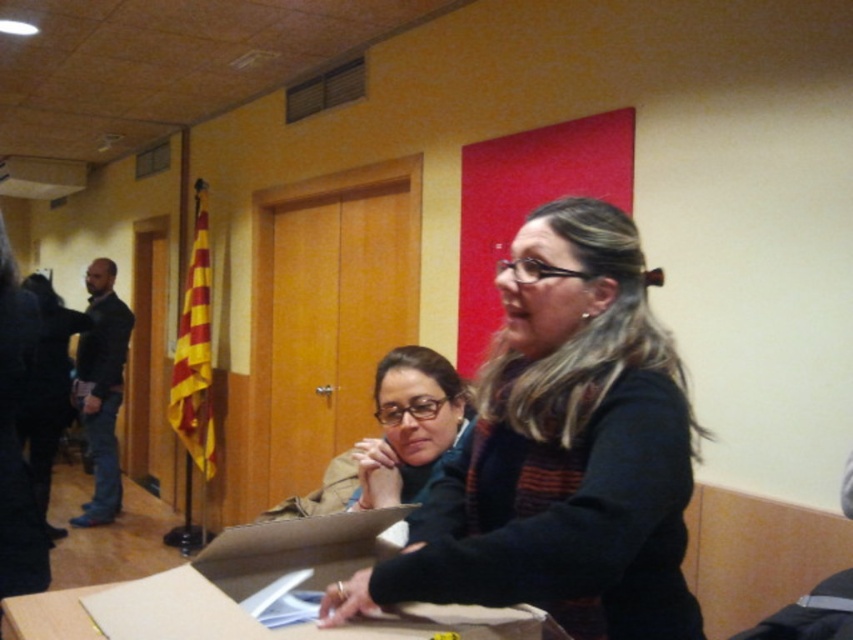
Can you confirm if black sweater at center is positioned to the left of matte black glasses at center?

No, black sweater at center is not to the left of matte black glasses at center.

Can you confirm if black sweater at center is taller than matte black glasses at center?

Correct, black sweater at center is much taller as matte black glasses at center.

The height and width of the screenshot is (640, 853). What are the coordinates of `black sweater at center` in the screenshot? It's located at (561, 451).

Is point (682, 605) positioned behind point (311, 516)?

No, (682, 605) is closer to viewer.

Consider the image. Who is positioned more to the right, black sweater at center or brown cardboard box at center?

black sweater at center

Who is more forward, (x=683, y=444) or (x=511, y=625)?

Positioned in front is point (x=511, y=625).

Find the location of a particular element. Image resolution: width=853 pixels, height=640 pixels. black sweater at center is located at coordinates (561, 451).

Is point (166, 621) positioned before point (424, 440)?

Yes, point (166, 621) is closer to viewer.

Who is positioned more to the right, brown cardboard box at center or matte black glasses at center?

matte black glasses at center is more to the right.

Who is more distant from viewer, (358, 522) or (413, 484)?

The point (413, 484) is more distant.

Locate an element on the screen. The width and height of the screenshot is (853, 640). brown cardboard box at center is located at coordinates (257, 592).